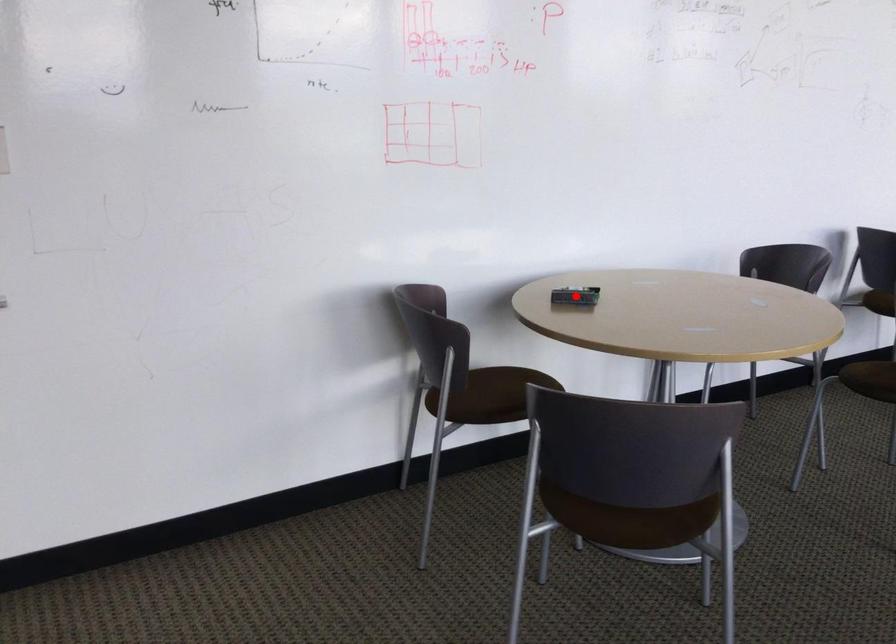
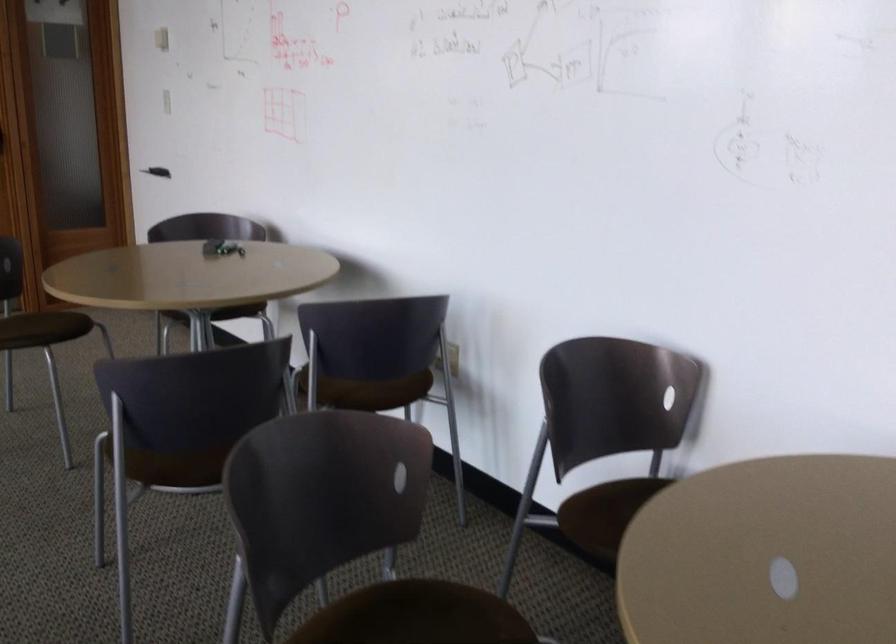
Question: I am providing you with two images of the same scene from different viewpoints. A red point is marked on the first image. At the location where the point appears in image 1, is it still visible in image 2?

Choices:
 (A) Yes
 (B) No

Answer: (B)